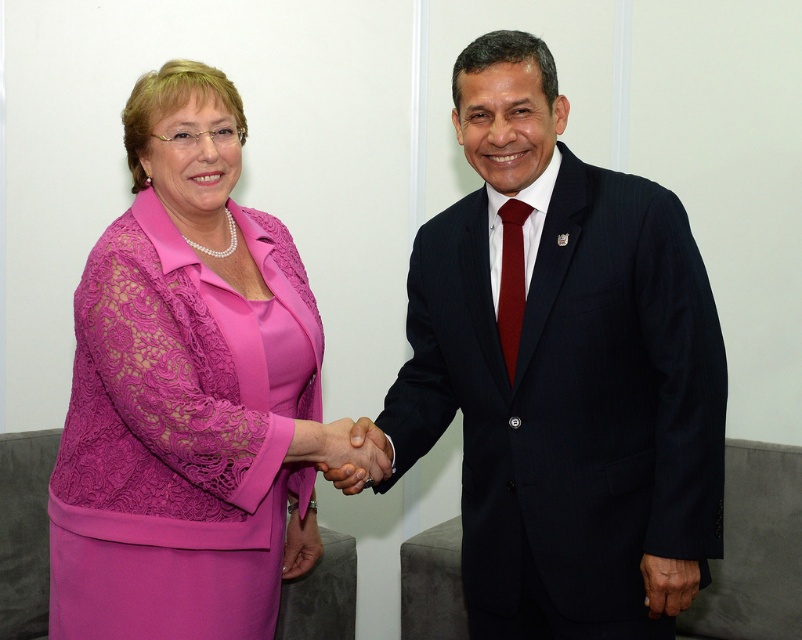
You are a photographer standing 5 feet away from the camera. You want to take a photo of the dark blue pinstripe suit at center. Can you move closer to get a better shot?

The dark blue pinstripe suit at center is 4.94 feet away from the camera. Since you are already standing 5 feet away from the camera, you can move slightly closer to get a better shot as the distance between you and the subject is almost the same.

You are a photographer setting up for a formal event. You need to ensure that the matte pink dress at center is fully visible in the photo without any part being cut off. Given that the smooth skin handshake at center is currently blocking part of the dress, can you determine if adjusting the camera angle slightly to focus on the handshake might still allow the entire dress to be captured?

The matte pink dress at center is wider than the smooth skin handshake at center, so adjusting the camera angle to focus on the handshake while keeping the dress in frame should be possible since the dress is wider and less likely to be fully obscured by the narrower handshake.

You are a photographer adjusting the focus on your camera. You need to focus on both the point at point (205, 172) and the point at point (320, 465). Which point should you focus on first to ensure both are in sharp focus?

You should focus on point (205, 172) first because it is closer to the camera than point (320, 465). This way, adjusting the focus from near to far will help both points come into sharp focus.